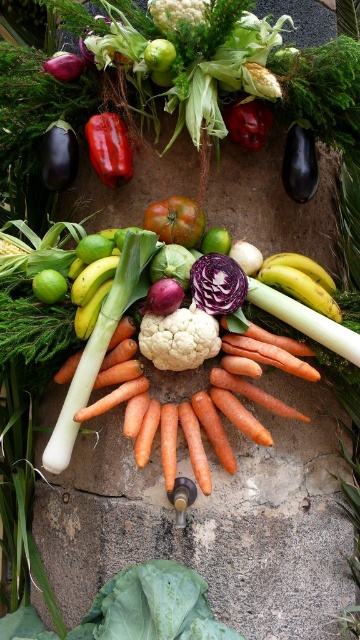
Consider the image. Does green matte cauliflower at upper center have a greater height compared to purple smooth cabbage at center?

Indeed, green matte cauliflower at upper center has a greater height compared to purple smooth cabbage at center.

Which is behind, point (151, 40) or point (216, 237)?

Positioned behind is point (216, 237).

Who is more distant from viewer, [162,56] or [218,243]?

The point [218,243] is behind.

Identify the location of green matte cauliflower at upper center. (159, 54).

Who is more forward, (119,156) or (164,474)?

Point (164,474) is in front.

Where is `shiny red pepper at upper center`? shiny red pepper at upper center is located at coordinates (109, 147).

Can you confirm if orange matte carrots at center is thinner than purple smooth cabbage at center?

In fact, orange matte carrots at center might be wider than purple smooth cabbage at center.

Does point (241, 396) lie behind point (205, 236)?

Yes, it is behind point (205, 236).

You are a GUI agent. You are given a task and a screenshot of the screen. Output one action in this format:
    pyautogui.click(x=<x>, y=<y>)
    Task: Click on the orange matte carrots at center
    The width and height of the screenshot is (360, 640).
    Given the screenshot: What is the action you would take?
    pyautogui.click(x=235, y=401)